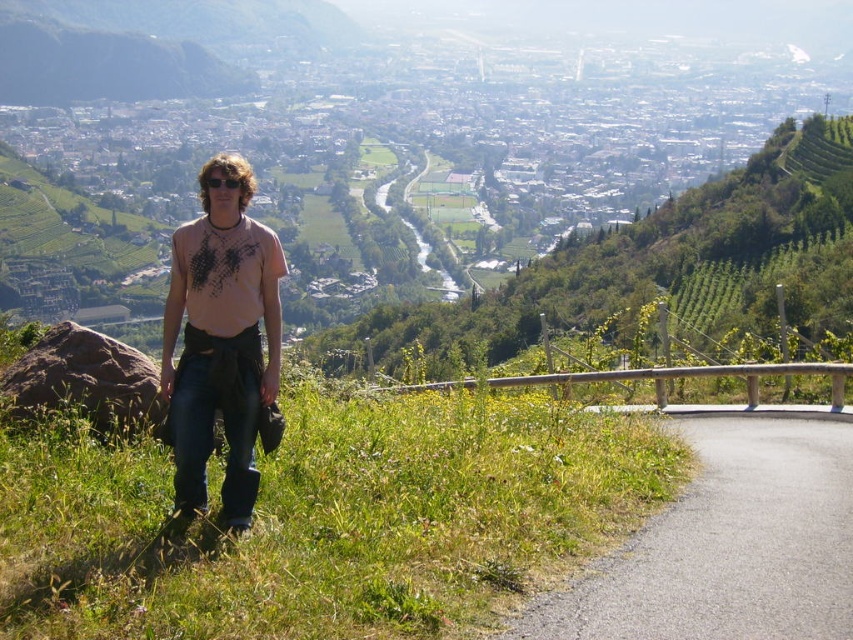
In the scene shown: You are a hiker who wants to take a photo of the asphalt road at lower right and the ripped denim jeans at lower left. Which object should you zoom in on to make them appear larger in your photo?

You should zoom in on the ripped denim jeans at lower left because it is larger than the asphalt road at lower right.

You are a pedestrian standing at the viewpoint and want to walk down to the asphalt road at lower right. Which direction should you head relative to the ripped denim jeans at lower left?

The asphalt road at lower right is positioned on the right side of the ripped denim jeans at lower left, so you should head to the right of the ripped denim jeans at lower left to reach it.